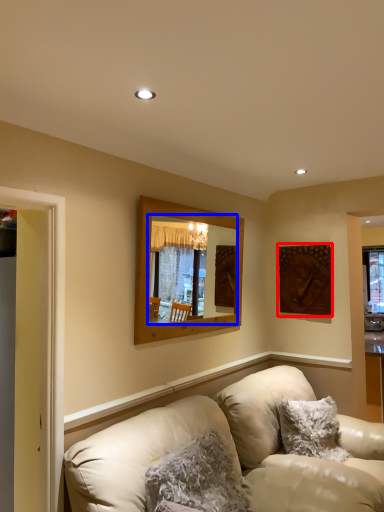
Question: Which object appears closest to the camera in this image, picture frame (highlighted by a red box) or mirror (highlighted by a blue box)?

Choices:
 (A) picture frame
 (B) mirror

Answer: (B)